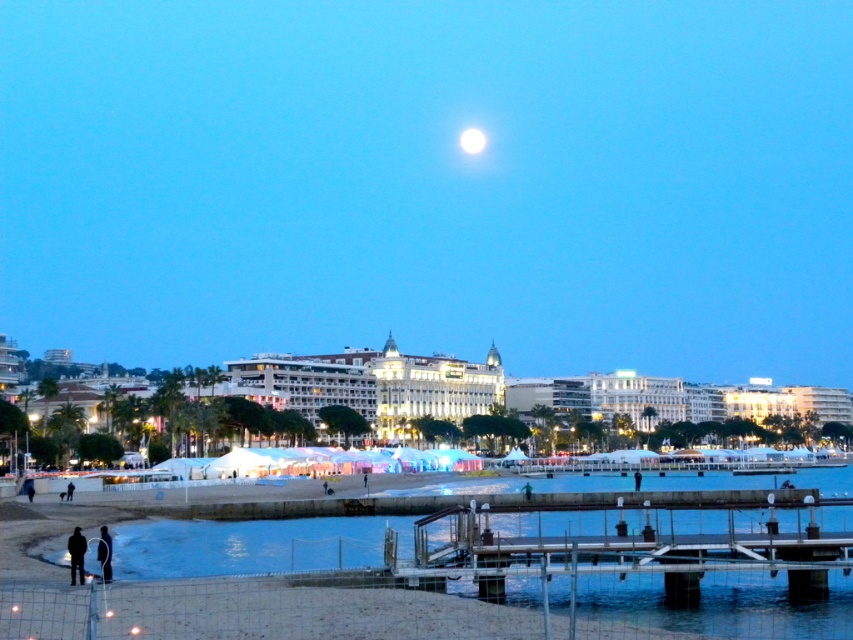
Question: Can you confirm if metallic gray dock at lower center is positioned below dark clothing figure at lower left?

Choices:
 (A) yes
 (B) no

Answer: (B)

Question: Is black matte person at lower left below bright white orb at upper center?

Choices:
 (A) no
 (B) yes

Answer: (B)

Question: Observing the image, what is the correct spatial positioning of black matte person at lower left in reference to bright white orb at upper center?

Choices:
 (A) left
 (B) right

Answer: (A)

Question: Estimate the real-world distances between objects in this image. Which object is farther from the black matte person at lower left?

Choices:
 (A) metallic gray dock at lower center
 (B) bright white orb at upper center
 (C) dark clothing figure at lower left

Answer: (B)

Question: Which point is farther from the camera taking this photo?

Choices:
 (A) (772, 529)
 (B) (108, 580)

Answer: (A)

Question: Which object is farther from the camera taking this photo?

Choices:
 (A) metallic gray dock at lower center
 (B) black matte person at lower left
 (C) dark clothing figure at lower left
 (D) bright white orb at upper center

Answer: (D)